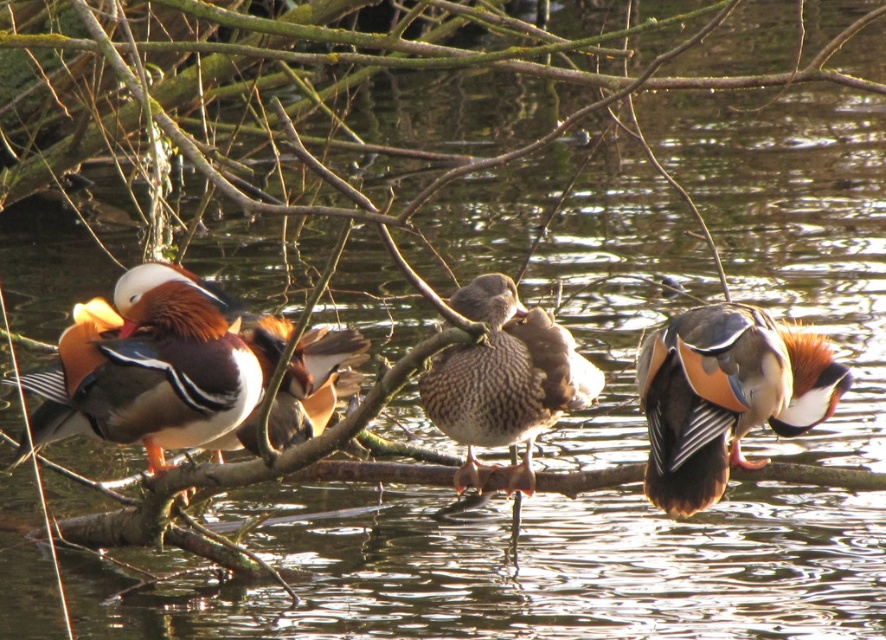
Is shiny brown duck at left positioned behind speckled feather duck at center?

Yes, shiny brown duck at left is further from the viewer.

Between point (195, 368) and point (436, 403), which one is positioned behind?

The point (195, 368) is behind.

Is point (189, 419) positioned after point (542, 328)?

No, it is in front of (542, 328).

Image resolution: width=886 pixels, height=640 pixels. Identify the location of shiny brown duck at left. (158, 365).

Who is more forward, (x=262, y=349) or (x=815, y=410)?

Point (x=815, y=410) is more forward.

Does shiny brown duck at left lie in front of shiny orange duck at right?

That is False.

Is point (115, 326) positioned in front of point (740, 397)?

That is False.

Find the location of a particular element. This screenshot has width=886, height=640. shiny brown duck at left is located at coordinates (158, 365).

Does point (545, 394) lie behind point (262, 317)?

No, it is in front of (262, 317).

Is speckled feather duck at center above shiny orange duck at center?

Indeed, speckled feather duck at center is positioned over shiny orange duck at center.

Where is `speckled feather duck at center`? The width and height of the screenshot is (886, 640). speckled feather duck at center is located at coordinates (504, 378).